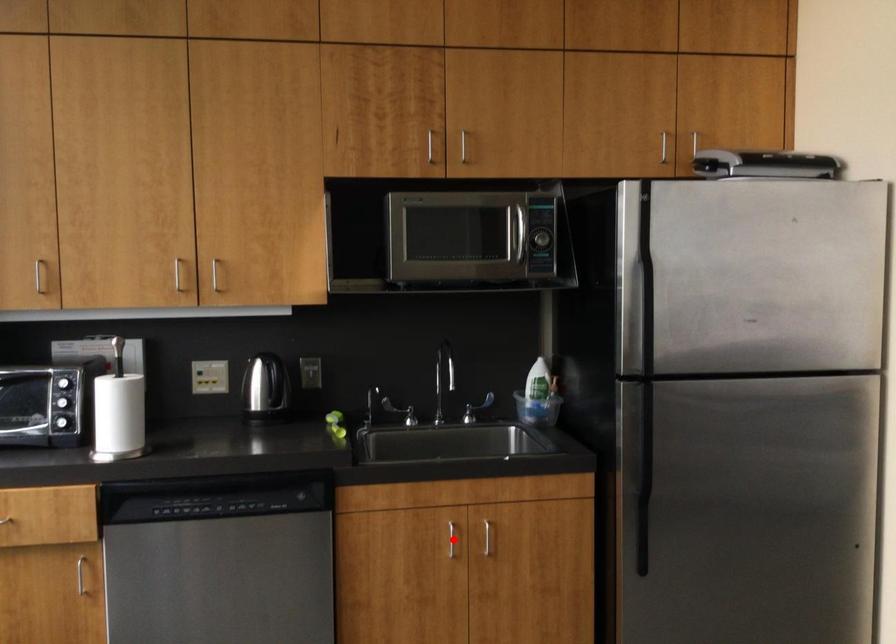
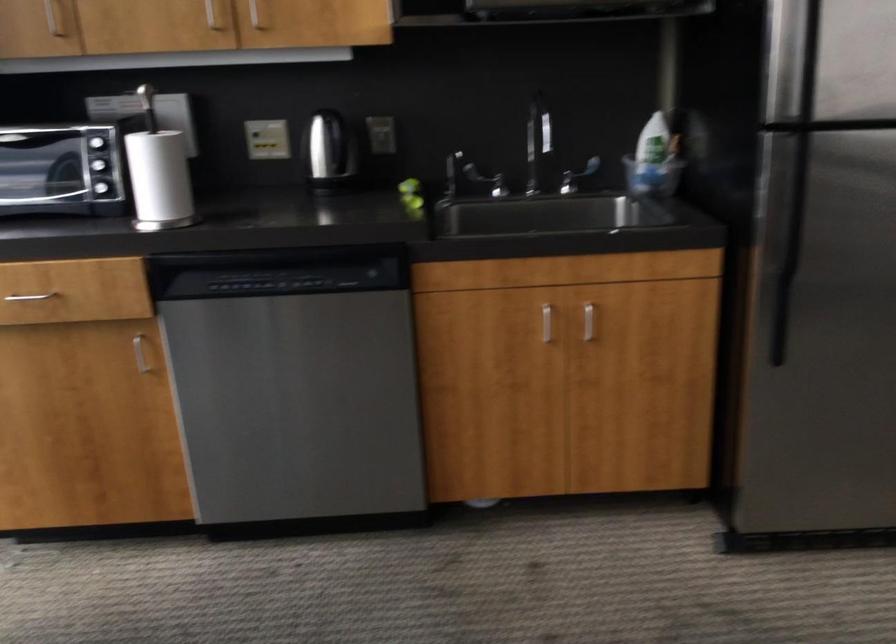
Where in the second image is the point corresponding to the highlighted location from the first image?

(546, 323)